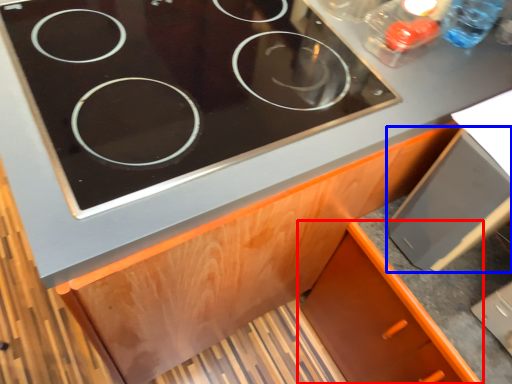
Question: Which object appears farthest to the camera in this image, cabinetry (highlighted by a red box) or appliance (highlighted by a blue box)?

Choices:
 (A) cabinetry
 (B) appliance

Answer: (A)